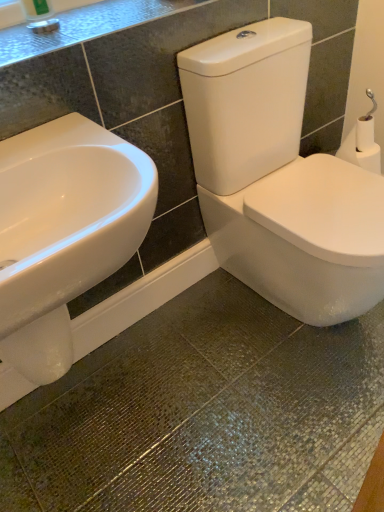
Question: Considering the relative sizes of granite countertop at upper left and white matte toilet paper at right in the image provided, is granite countertop at upper left smaller than white matte toilet paper at right?

Choices:
 (A) yes
 (B) no

Answer: (B)

Question: Does granite countertop at upper left have a greater height compared to white matte toilet paper at right?

Choices:
 (A) yes
 (B) no

Answer: (B)

Question: Can white matte toilet paper at right be found inside granite countertop at upper left?

Choices:
 (A) yes
 (B) no

Answer: (B)

Question: Is granite countertop at upper left directly adjacent to white matte toilet paper at right?

Choices:
 (A) no
 (B) yes

Answer: (A)

Question: Would you say granite countertop at upper left is outside white matte toilet paper at right?

Choices:
 (A) yes
 (B) no

Answer: (A)

Question: From a real-world perspective, is granite countertop at upper left under white matte toilet paper at right?

Choices:
 (A) no
 (B) yes

Answer: (A)

Question: Can you confirm if white matte toilet paper at right is bigger than granite countertop at upper left?

Choices:
 (A) no
 (B) yes

Answer: (A)

Question: From a real-world perspective, is white matte toilet paper at right on top of granite countertop at upper left?

Choices:
 (A) yes
 (B) no

Answer: (B)

Question: Does white matte toilet paper at right touch granite countertop at upper left?

Choices:
 (A) yes
 (B) no

Answer: (B)

Question: Does white matte toilet paper at right appear on the left side of granite countertop at upper left?

Choices:
 (A) yes
 (B) no

Answer: (B)

Question: From the image's perspective, would you say white matte toilet paper at right is positioned over granite countertop at upper left?

Choices:
 (A) yes
 (B) no

Answer: (B)

Question: Does white matte toilet paper at right turn towards granite countertop at upper left?

Choices:
 (A) yes
 (B) no

Answer: (B)

Question: From a real-world perspective, is white matte toilet paper at right located beneath white glossy sink at left?

Choices:
 (A) yes
 (B) no

Answer: (A)